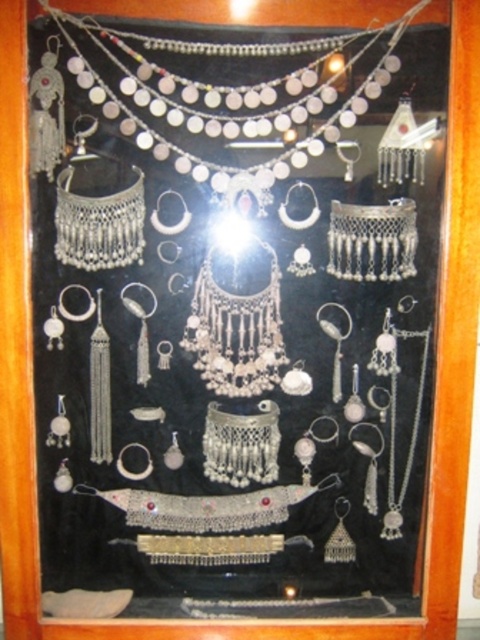
Can you confirm if silver metallic necklace at upper center is smaller than silver metallic necklace at center?

No.

Can you confirm if silver metallic necklace at upper center is positioned to the right of silver metallic necklace at center?

Yes, silver metallic necklace at upper center is to the right of silver metallic necklace at center.

Who is more distant from viewer, (167, 108) or (204, 275)?

Positioned behind is point (204, 275).

At what (x,y) coordinates should I click in order to perform the action: click on silver metallic necklace at upper center. Please return your answer as a coordinate pair (x, y). The width and height of the screenshot is (480, 640). Looking at the image, I should click on (233, 97).